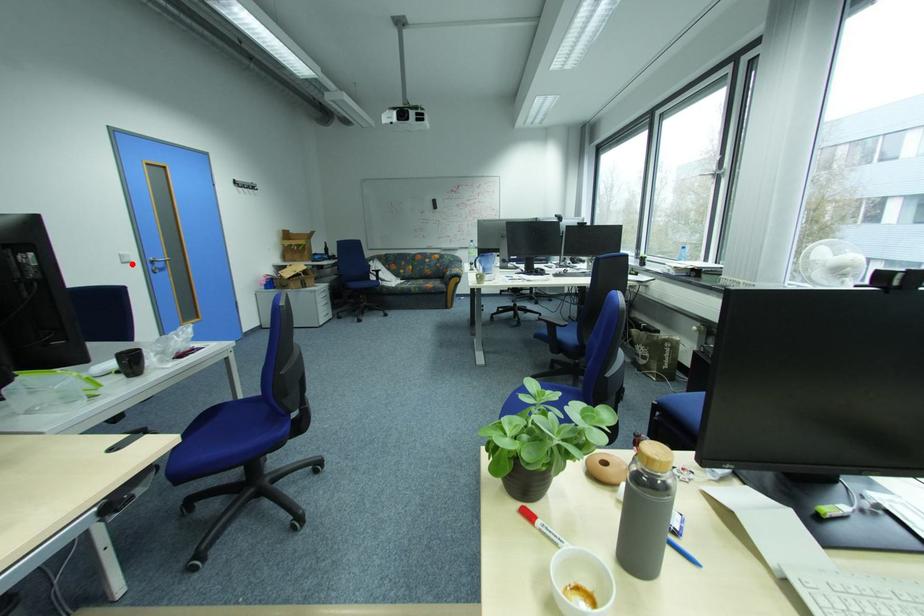
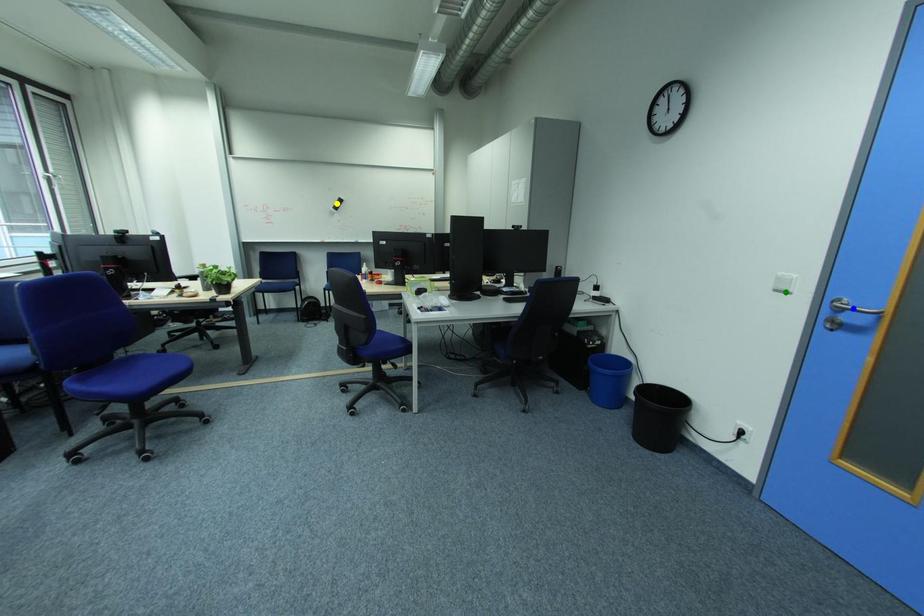
Question: I am providing you with two images of the same scene from different viewpoints. A red point is marked on the first image. You are given multiple points on the second image. Which point in image 2 represents the same 3d spot as the red point in image 1?

Choices:
 (A) yellow point
 (B) blue point
 (C) green point

Answer: (C)